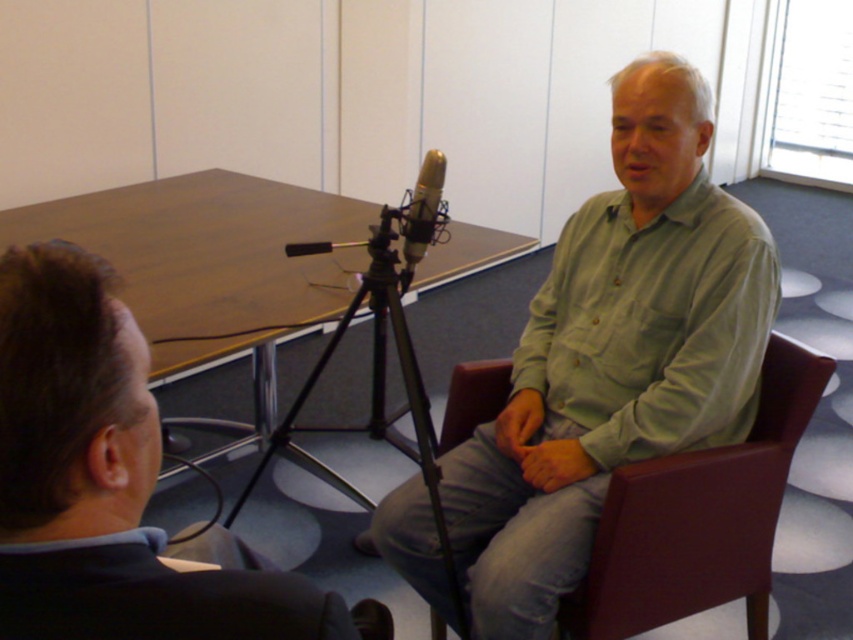
You are an interior designer assessing the placement of clothing items in a room. You notice the green matte shirt at center and the dark gray suit at left. Which clothing item is positioned higher up in the image?

The green matte shirt at center is taller than the dark gray suit at left, so it is positioned higher up in the image.

You are organizing a photoshoot and need to ensure that the green matte shirt at center and the dark gray suit at left are framed properly. Which clothing item has a greater width when viewed from the front?

The green matte shirt at center has a greater width than the dark gray suit at left.

You are standing in the room and want to place a small plant between the wooden at center and the brown leather chair at right. According to the scene, where should you place it?

You should place the small plant to the left of the brown leather chair at right, as the wooden at center is located to the left of it.